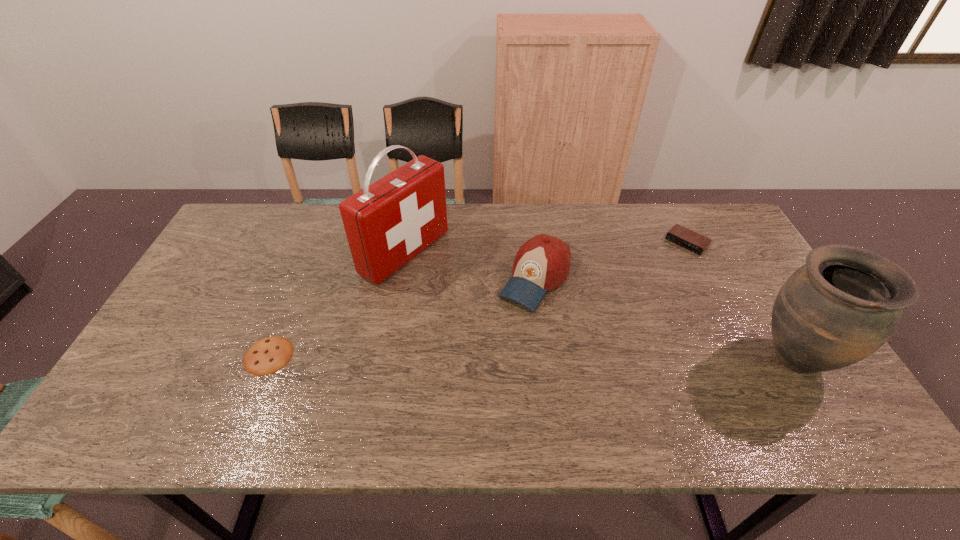
Image resolution: width=960 pixels, height=540 pixels. What are the coordinates of `vacant space on the desktop that is between the cookie and the second tallest object and is positioned on the front-facing side of the third object from left to right` in the screenshot? It's located at (478, 356).

This screenshot has height=540, width=960. I want to click on free spot on the desktop that is between the leftmost object and the urn and is positioned on the front face of the tallest object, so click(x=588, y=357).

The width and height of the screenshot is (960, 540). In order to click on vacant space on the desktop that is between the cookie and the fourth shortest object and is positioned on the front face of the alarm clock in this screenshot , I will do `click(576, 357)`.